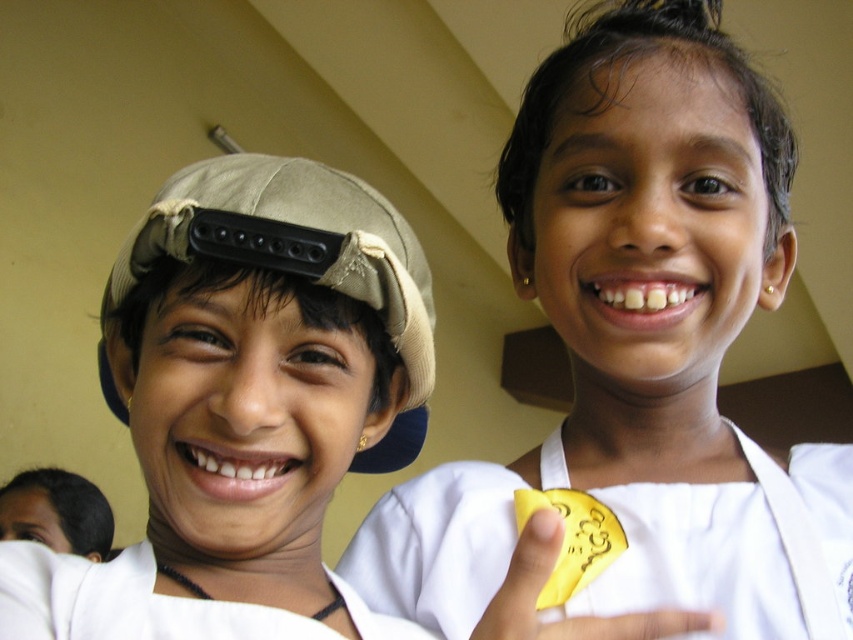
Question: Can you confirm if gold shiny coin at upper right is positioned to the left of beige fabric baseball hat at left?

Choices:
 (A) yes
 (B) no

Answer: (B)

Question: Is gold shiny coin at upper right to the right of beige fabric baseball hat at left from the viewer's perspective?

Choices:
 (A) yes
 (B) no

Answer: (A)

Question: Estimate the real-world distances between objects in this image. Which object is closer to the gold shiny coin at upper right?

Choices:
 (A) beige fabric baseball hat at left
 (B) matte beige cap at left

Answer: (B)

Question: Based on their relative distances, which object is farther from the matte beige cap at left?

Choices:
 (A) gold shiny coin at upper right
 (B) beige fabric baseball hat at left

Answer: (A)

Question: Which object appears closest to the camera in this image?

Choices:
 (A) gold shiny coin at upper right
 (B) beige fabric baseball hat at left

Answer: (A)

Question: Observing the image, what is the correct spatial positioning of gold shiny coin at upper right in reference to beige fabric baseball hat at left?

Choices:
 (A) left
 (B) right

Answer: (B)